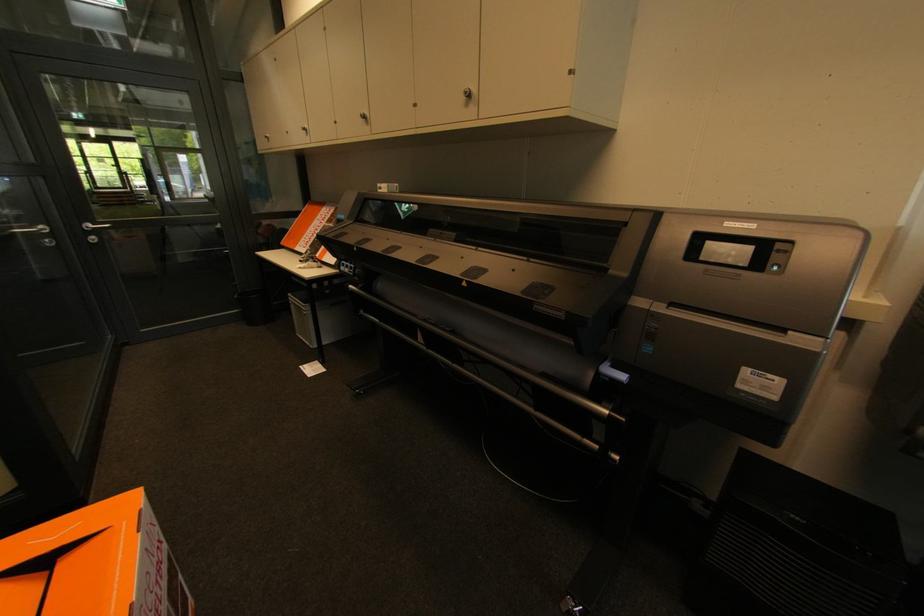
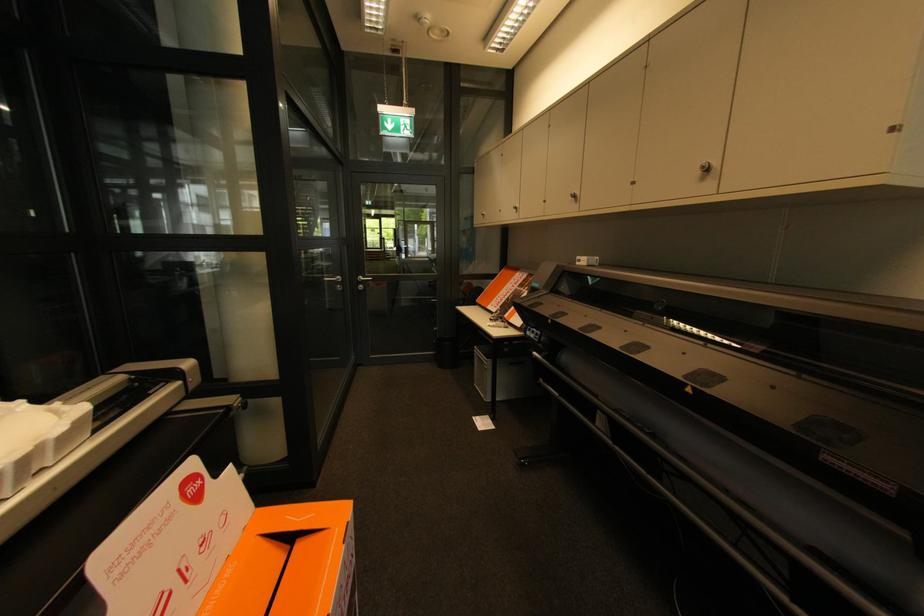
Locate, in the second image, the point that corresponds to (x=574, y=74) in the first image.

(895, 130)